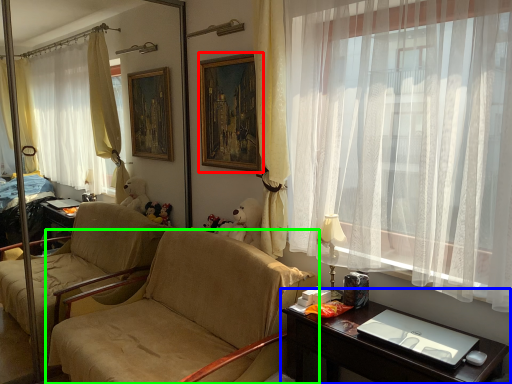
Question: Which object is positioned farthest from picture frame (highlighted by a red box)? Select from desk (highlighted by a blue box) and chair (highlighted by a green box).

Choices:
 (A) desk
 (B) chair

Answer: (A)